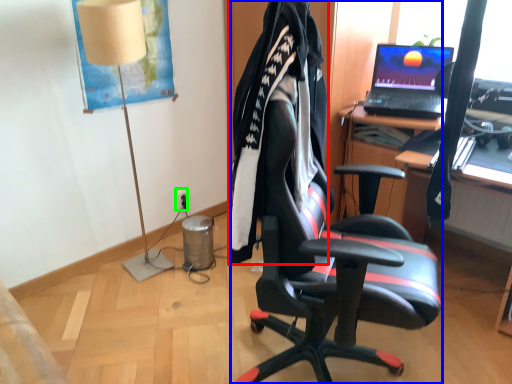
Question: Based on their relative distances, which object is farther from clothing (highlighted by a red box)? Choose from chair (highlighted by a blue box) and power outlet (highlighted by a green box).

Choices:
 (A) chair
 (B) power outlet

Answer: (B)